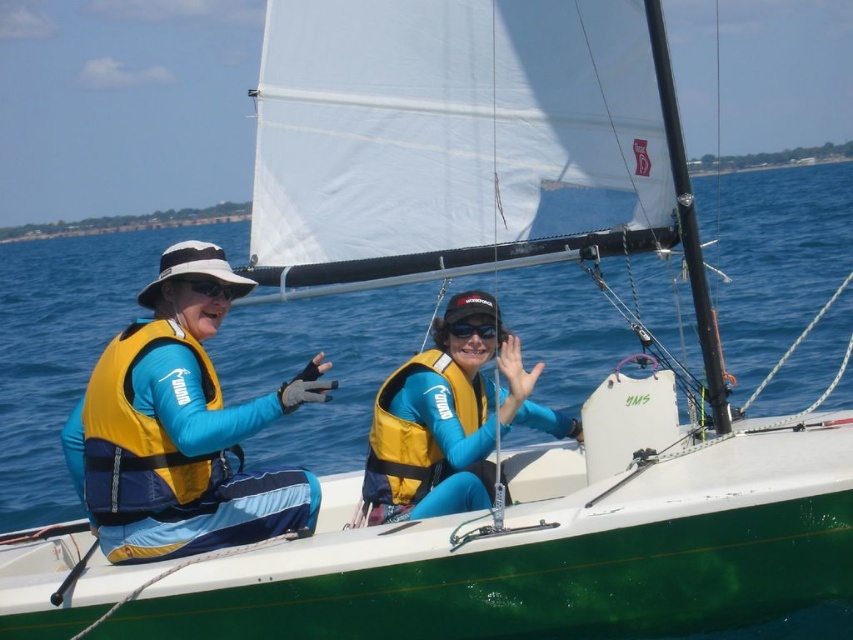
Question: Estimate the real-world distances between objects in this image. Which object is farther from the black matte sunglasses at left?

Choices:
 (A) yellow life vest at center
 (B) black matte goggles at center

Answer: (B)

Question: Is the position of black matte goggles at center less distant than that of black matte sunglasses at left?

Choices:
 (A) yes
 (B) no

Answer: (B)

Question: Estimate the real-world distances between objects in this image. Which object is closer to the yellow fabric life vest at left?

Choices:
 (A) black matte sunglasses at left
 (B) yellow fabric life jacket at left
 (C) yellow life jacket at center
 (D) yellow life vest at center

Answer: (B)

Question: Does black matte goggles at center have a greater width compared to black matte sunglasses at left?

Choices:
 (A) no
 (B) yes

Answer: (B)

Question: Which object is the farthest from the black matte goggles at center?

Choices:
 (A) yellow life vest at center
 (B) yellow fabric life jacket at left

Answer: (B)

Question: Can you confirm if yellow fabric life vest at left is thinner than black matte goggles at center?

Choices:
 (A) yes
 (B) no

Answer: (B)